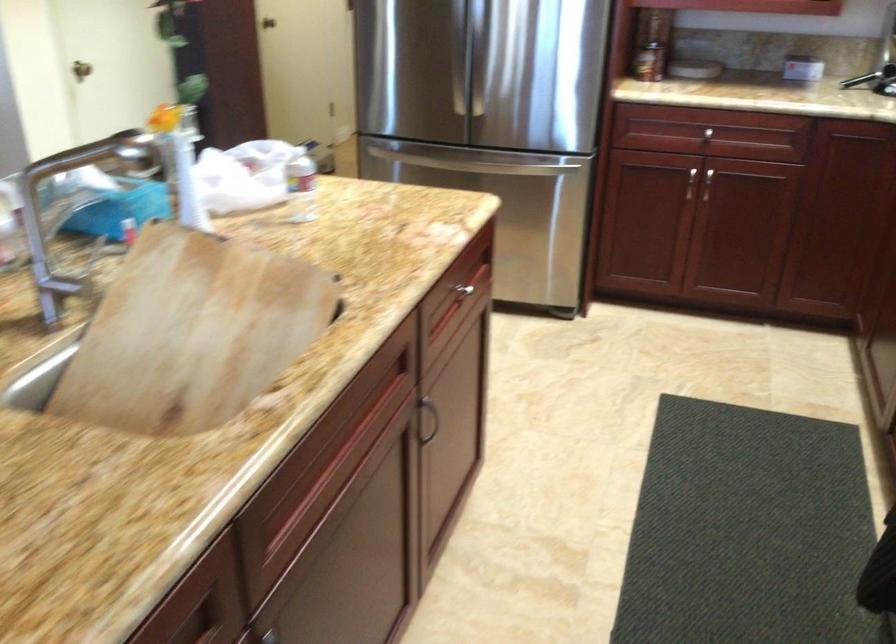
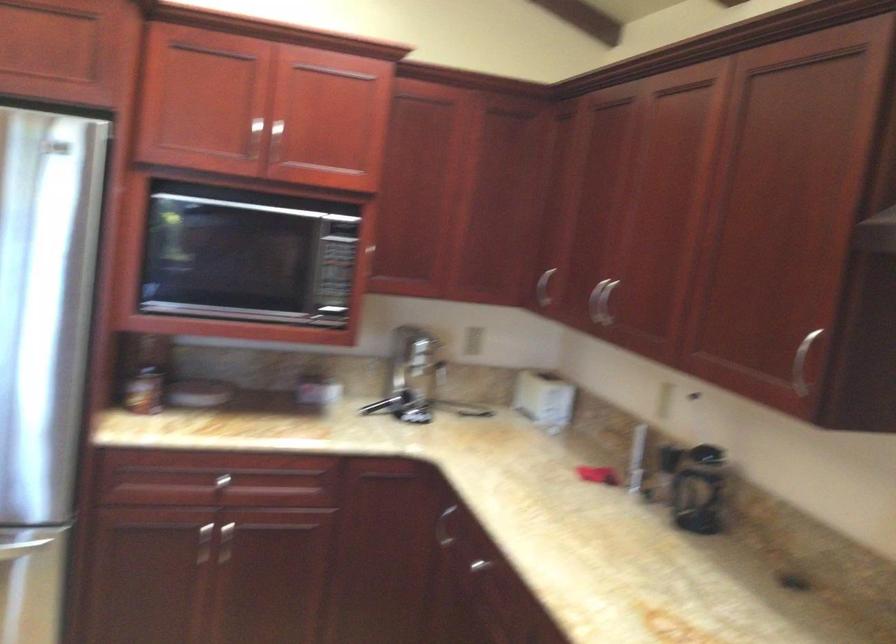
Question: I am providing you with two images of the same scene from different viewpoints. After the viewpoint changes to image2, which objects are now occluded?

Choices:
 (A) refrigerator handle
 (B) curved silver handle
 (C) silver faucet handle
 (D) none of these

Answer: (D)